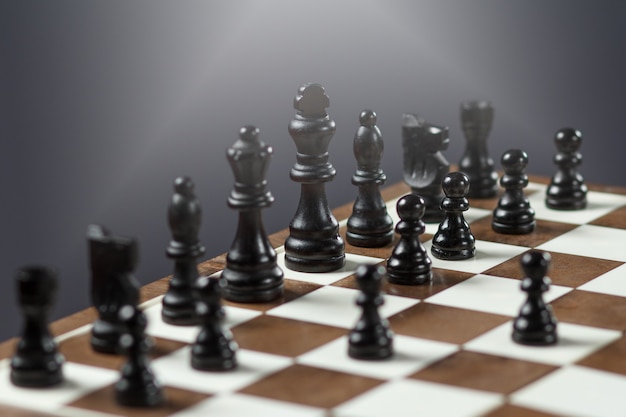
Where is `brown and white chess board`? brown and white chess board is located at coordinates (447, 316).